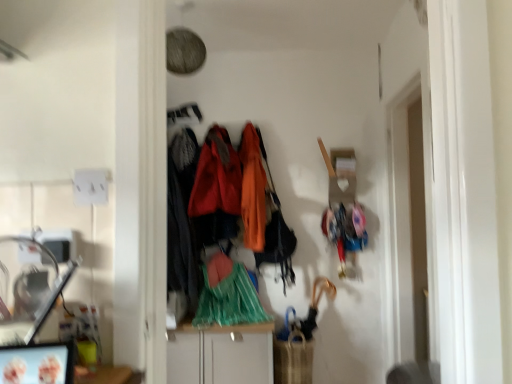
Question: Is green plastic bag at center, the second clothing from the right, facing away from white glossy cabinet at center?

Choices:
 (A) no
 (B) yes

Answer: (A)

Question: Does green plastic bag at center, which is the third clothing in left-to-right order, have a lesser width compared to white glossy cabinet at center?

Choices:
 (A) yes
 (B) no

Answer: (A)

Question: Can you confirm if green plastic bag at center, the second clothing from the right, is taller than white glossy cabinet at center?

Choices:
 (A) no
 (B) yes

Answer: (A)

Question: Is green plastic bag at center, the second clothing from the right, to the right of white glossy cabinet at center from the viewer's perspective?

Choices:
 (A) yes
 (B) no

Answer: (A)

Question: Can you confirm if green plastic bag at center, the second clothing from the right, is positioned to the left of white glossy cabinet at center?

Choices:
 (A) no
 (B) yes

Answer: (A)

Question: Does point (208, 301) appear closer or farther from the camera than point (249, 147)?

Choices:
 (A) closer
 (B) farther

Answer: (A)

Question: Is green plastic bag at center, which is the third clothing in left-to-right order, in front of or behind orange fabric coat at center, which appears as the fourth clothing when viewed from the left, in the image?

Choices:
 (A) behind
 (B) front

Answer: (B)

Question: Is green plastic bag at center, the second clothing from the right, spatially inside orange fabric coat at center, acting as the first clothing starting from the right, or outside of it?

Choices:
 (A) inside
 (B) outside

Answer: (B)

Question: In the image, is green plastic bag at center, the second clothing from the right, on the left side or the right side of orange fabric coat at center, acting as the first clothing starting from the right?

Choices:
 (A) right
 (B) left

Answer: (B)

Question: Is velvet orange coat at center, which ranks as the 3th clothing in right-to-left order, in front of or behind white glossy cabinet at center in the image?

Choices:
 (A) front
 (B) behind

Answer: (B)

Question: From a real-world perspective, is velvet orange coat at center, which ranks as the 3th clothing in right-to-left order, positioned above or below white glossy cabinet at center?

Choices:
 (A) below
 (B) above

Answer: (B)

Question: From the image's perspective, relative to white glossy cabinet at center, is velvet orange coat at center, which ranks as the 3th clothing in right-to-left order, above or below?

Choices:
 (A) above
 (B) below

Answer: (A)

Question: Considering the positions of velvet orange coat at center, which ranks as the 3th clothing in right-to-left order, and white glossy cabinet at center in the image, is velvet orange coat at center, which ranks as the 3th clothing in right-to-left order, wider or thinner than white glossy cabinet at center?

Choices:
 (A) thin
 (B) wide

Answer: (A)

Question: Is velvet-like black coat at center, which appears as the first clothing when viewed from the left, wider or thinner than white glossy cabinet at center?

Choices:
 (A) wide
 (B) thin

Answer: (B)

Question: From the image's perspective, is velvet-like black coat at center, positioned as the fourth clothing in right-to-left order, above or below white glossy cabinet at center?

Choices:
 (A) below
 (B) above

Answer: (B)